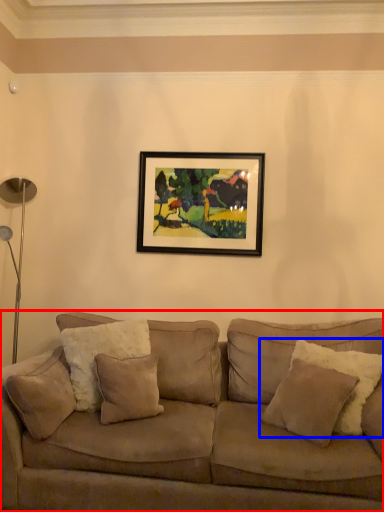
Question: Which point is further to the camera, studio couch (highlighted by a red box) or pillow (highlighted by a blue box)?

Choices:
 (A) studio couch
 (B) pillow

Answer: (B)